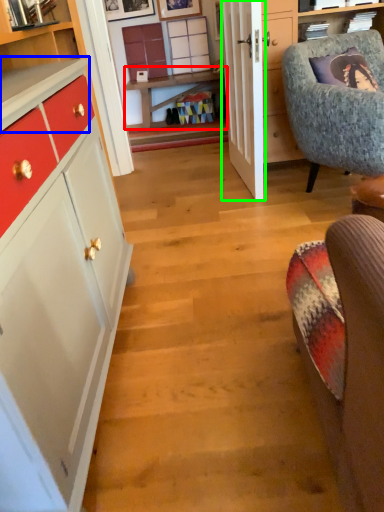
Question: Which object is the closest to the table (highlighted by a red box)? Choose among these: counter top (highlighted by a blue box) or door (highlighted by a green box).

Choices:
 (A) counter top
 (B) door

Answer: (B)